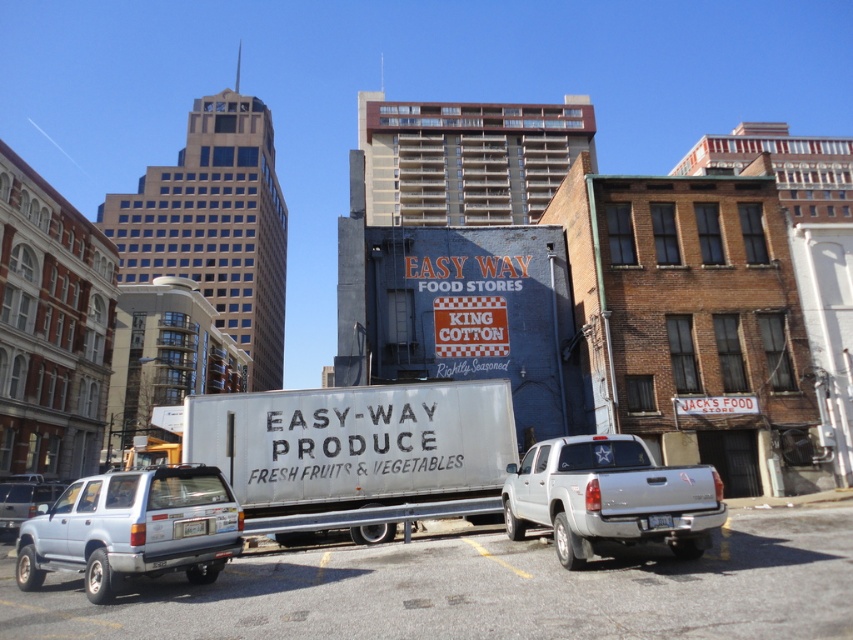
Does point (45, 499) come in front of point (184, 534)?

No, (45, 499) is further to viewer.

From the picture: Is silver metallic suv at lower left to the left of white plastic license plate at lower left from the viewer's perspective?

Indeed, silver metallic suv at lower left is positioned on the left side of white plastic license plate at lower left.

Which is in front, point (10, 522) or point (192, 532)?

Point (192, 532)

This screenshot has width=853, height=640. I want to click on silver metallic suv at lower left, so click(x=22, y=500).

From the picture: Is silver metallic suv at lower left thinner than white plastic license plate at center?

Incorrect, silver metallic suv at lower left's width is not less than white plastic license plate at center's.

Does silver metallic suv at lower left come in front of white plastic license plate at center?

No, it is behind white plastic license plate at center.

Does point (10, 481) lie in front of point (664, 522)?

No, it is not.

Locate an element on the screen. silver metallic suv at lower left is located at coordinates [22, 500].

Based on the photo, does white metallic trailer truck at center appear on the left side of satin silver suv at lower left?

In fact, white metallic trailer truck at center is to the right of satin silver suv at lower left.

Consider the image. Between white metallic trailer truck at center and satin silver suv at lower left, which one appears on the left side from the viewer's perspective?

Positioned to the left is satin silver suv at lower left.

Who is more distant from viewer, [364,394] or [233,554]?

The point [364,394] is behind.

You are a GUI agent. You are given a task and a screenshot of the screen. Output one action in this format:
    pyautogui.click(x=<x>, y=<y>)
    Task: Click on the white metallic trailer truck at center
    
    Given the screenshot: What is the action you would take?
    pyautogui.click(x=354, y=444)